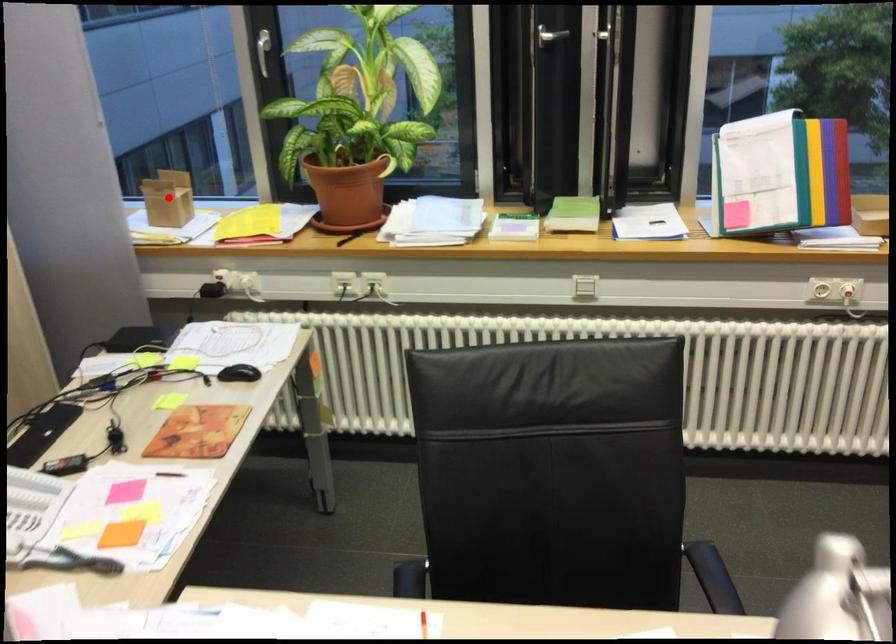
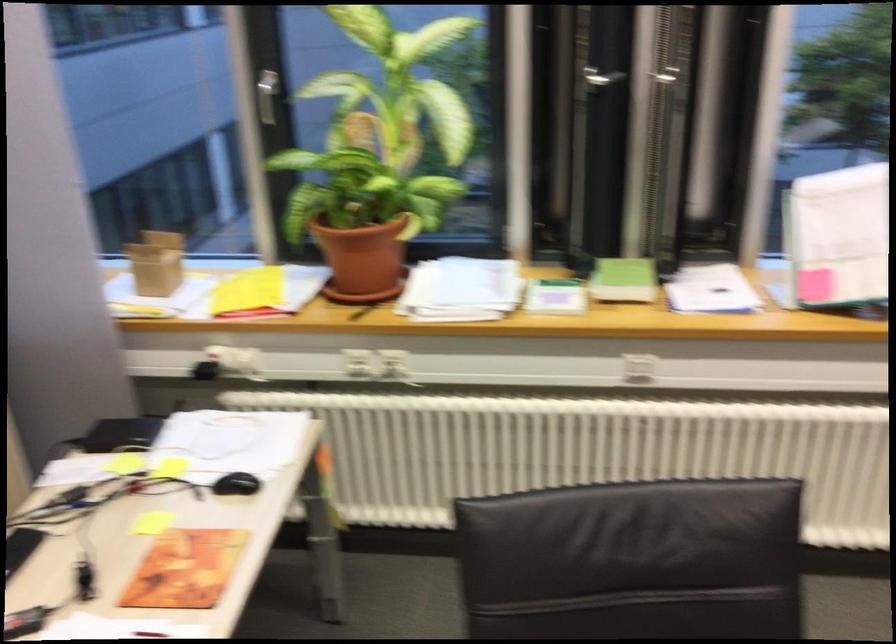
Where in the second image is the point corresponding to the highlighted location from the first image?

(156, 263)